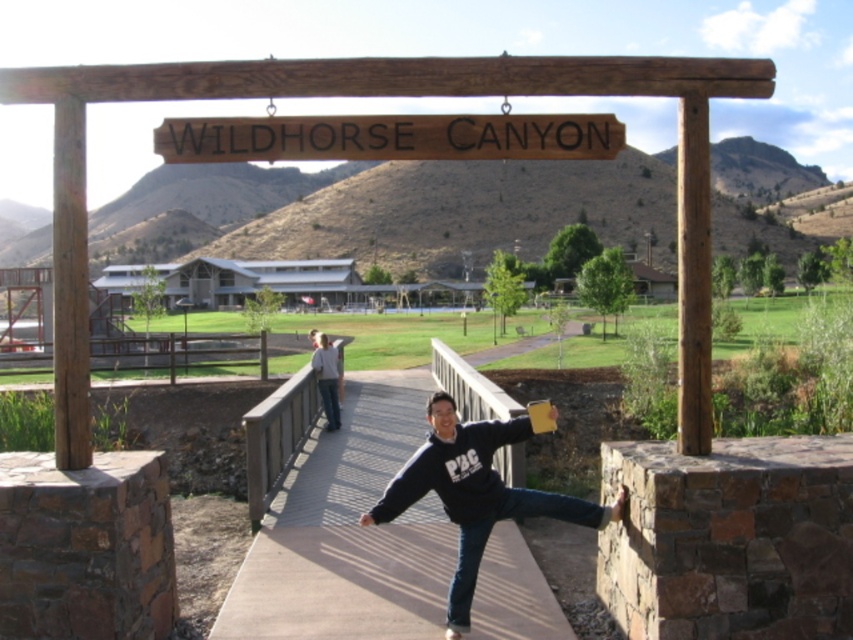
Question: Is black fleece at center smaller than light gray sweater at center?

Choices:
 (A) no
 (B) yes

Answer: (A)

Question: Which point is closer to the camera?

Choices:
 (A) brown wooden sign at center
 (B) black fleece at center
 (C) light gray sweater at center

Answer: (B)

Question: Can you confirm if concrete bridge at center is thinner than black fleece at center?

Choices:
 (A) no
 (B) yes

Answer: (A)

Question: Which is nearer to the concrete bridge at center?

Choices:
 (A) light gray sweater at center
 (B) black fleece at center
 (C) brown wooden sign at center

Answer: (B)

Question: Which object is the closest to the concrete bridge at center?

Choices:
 (A) brown wooden sign at center
 (B) light gray sweater at center
 (C) black fleece at center

Answer: (C)

Question: Considering the relative positions of brown wooden sign at center and light gray sweater at center in the image provided, where is brown wooden sign at center located with respect to light gray sweater at center?

Choices:
 (A) above
 (B) below

Answer: (A)